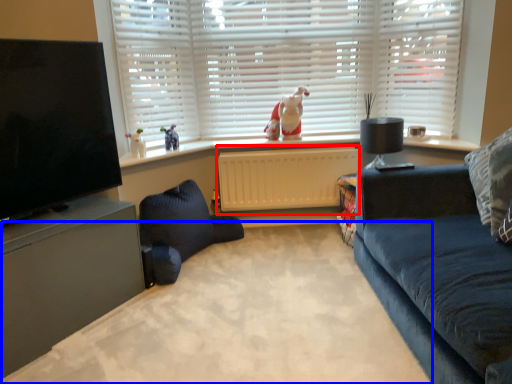
Question: Which of the following is the farthest to the observer, radiator (highlighted by a red box) or plain (highlighted by a blue box)?

Choices:
 (A) radiator
 (B) plain

Answer: (A)